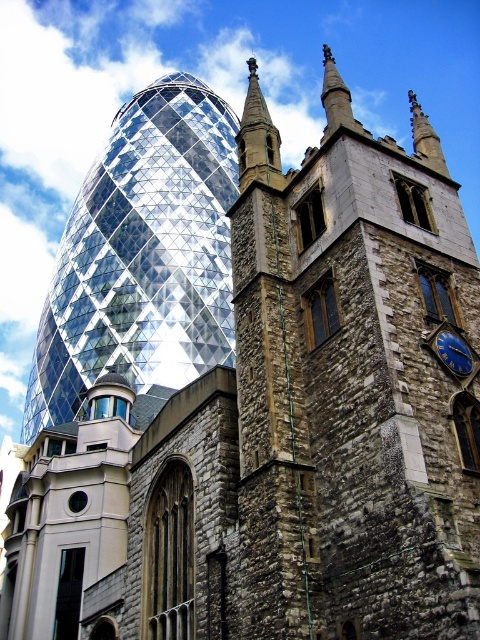
Is shiny glass tower at upper left further to the viewer compared to green stone spire at upper center?

Yes.

Who is more forward, (84, 244) or (261, 108)?

Point (261, 108) is more forward.

Between point (166, 298) and point (266, 144), which one is positioned in front?

Point (266, 144) is in front.

Where is `shiny glass tower at upper left`? The height and width of the screenshot is (640, 480). shiny glass tower at upper left is located at coordinates (143, 256).

Is green stone spire at upper center in front of blue metallic clock at upper right?

No, green stone spire at upper center is further to the viewer.

Which is behind, point (264, 160) or point (460, 348)?

Positioned behind is point (264, 160).

The height and width of the screenshot is (640, 480). What do you see at coordinates (257, 138) in the screenshot? I see `green stone spire at upper center` at bounding box center [257, 138].

I want to click on green stone spire at upper center, so click(257, 138).

Between shiny glass tower at upper left and blue metallic clock at upper right, which one has less height?

blue metallic clock at upper right is shorter.

Does shiny glass tower at upper left have a lesser height compared to blue metallic clock at upper right?

No.

Where is `shiny glass tower at upper left`? The width and height of the screenshot is (480, 640). shiny glass tower at upper left is located at coordinates (143, 256).

You are a GUI agent. You are given a task and a screenshot of the screen. Output one action in this format:
    pyautogui.click(x=<x>, y=<y>)
    Task: Click on the shiny glass tower at upper left
    The height and width of the screenshot is (640, 480).
    Given the screenshot: What is the action you would take?
    pyautogui.click(x=143, y=256)